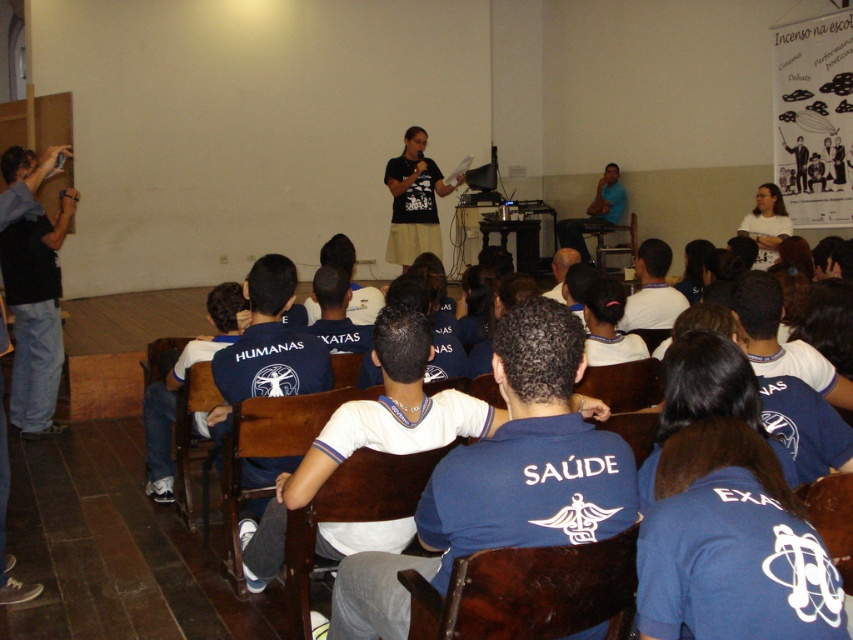
Question: Is black fabric shirt at center behind blue shirt at upper center?

Choices:
 (A) no
 (B) yes

Answer: (A)

Question: Is black fabric shirt at center thinner than blue shirt at upper center?

Choices:
 (A) yes
 (B) no

Answer: (A)

Question: Does black fabric shirt at center come in front of blue shirt at upper center?

Choices:
 (A) no
 (B) yes

Answer: (B)

Question: Estimate the real-world distances between objects in this image. Which object is closer to the black jeans at left?

Choices:
 (A) black fabric shirt at center
 (B) blue shirt at upper center

Answer: (A)

Question: Which point appears farthest from the camera in this image?

Choices:
 (A) (28, 369)
 (B) (402, 209)

Answer: (B)

Question: Which point appears closest to the camera in this image?

Choices:
 (A) (428, 228)
 (B) (561, 237)

Answer: (A)